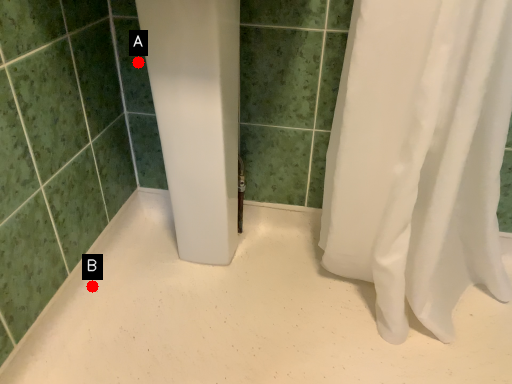
Question: Two points are circled on the image, labeled by A and B beside each circle. Which point appears closest to the camera in this image?

Choices:
 (A) A is closer
 (B) B is closer

Answer: (B)